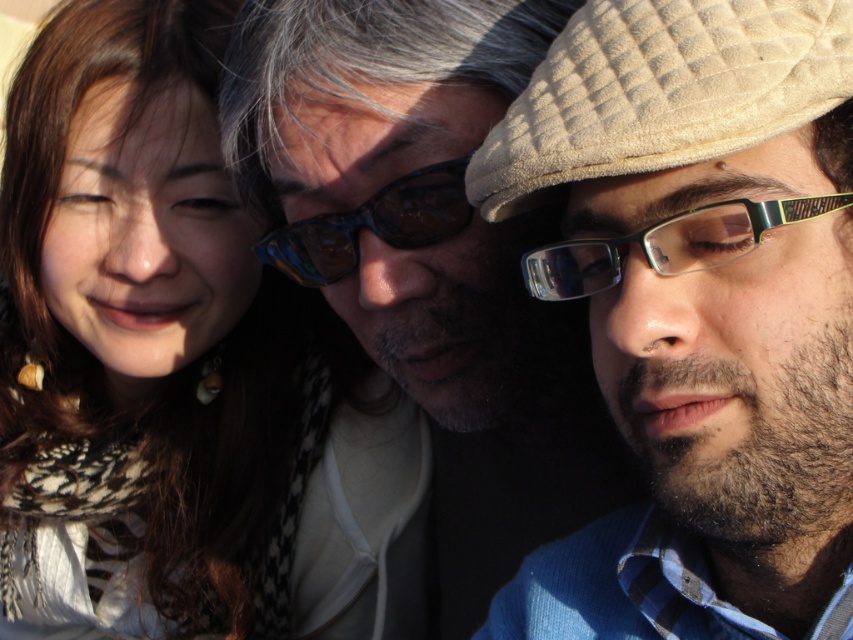
Question: Which object appears closest to the camera in this image?

Choices:
 (A) translucent blue plastic goggles at center
 (B) clear plastic glasses at center

Answer: (B)

Question: Is clear plastic glasses at center below translucent blue plastic goggles at center?

Choices:
 (A) no
 (B) yes

Answer: (B)

Question: Observing the image, what is the correct spatial positioning of sunglasses at center in reference to clear plastic glasses at center?

Choices:
 (A) below
 (B) above

Answer: (A)

Question: Which point appears closest to the camera in this image?

Choices:
 (A) (569, 291)
 (B) (305, 276)

Answer: (A)

Question: Does beige textured cap at upper right come in front of translucent blue plastic goggles at center?

Choices:
 (A) no
 (B) yes

Answer: (B)

Question: Which object is closer to the camera taking this photo?

Choices:
 (A) matte black scarf at upper left
 (B) sunglasses at center

Answer: (B)